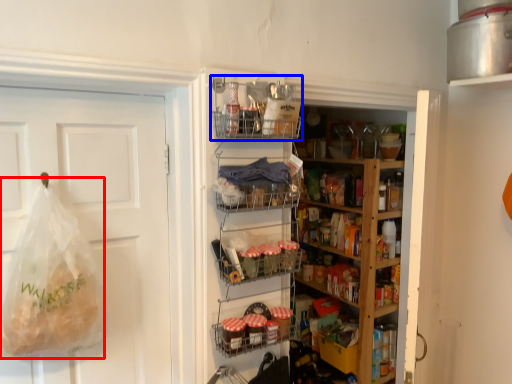
Question: Which object appears farthest to the camera in this image, grocery bag (highlighted by a red box) or shelf (highlighted by a blue box)?

Choices:
 (A) grocery bag
 (B) shelf

Answer: (B)